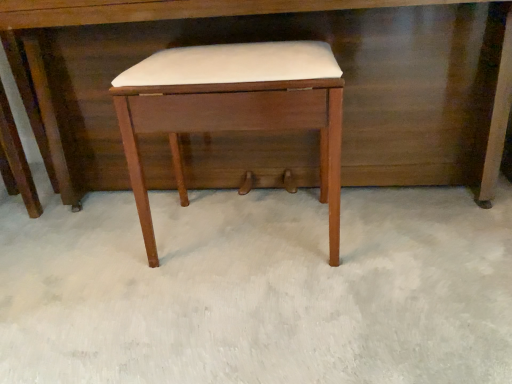
Where is `free spot in front of wooden desk at center`? This screenshot has width=512, height=384. free spot in front of wooden desk at center is located at coordinates (282, 307).